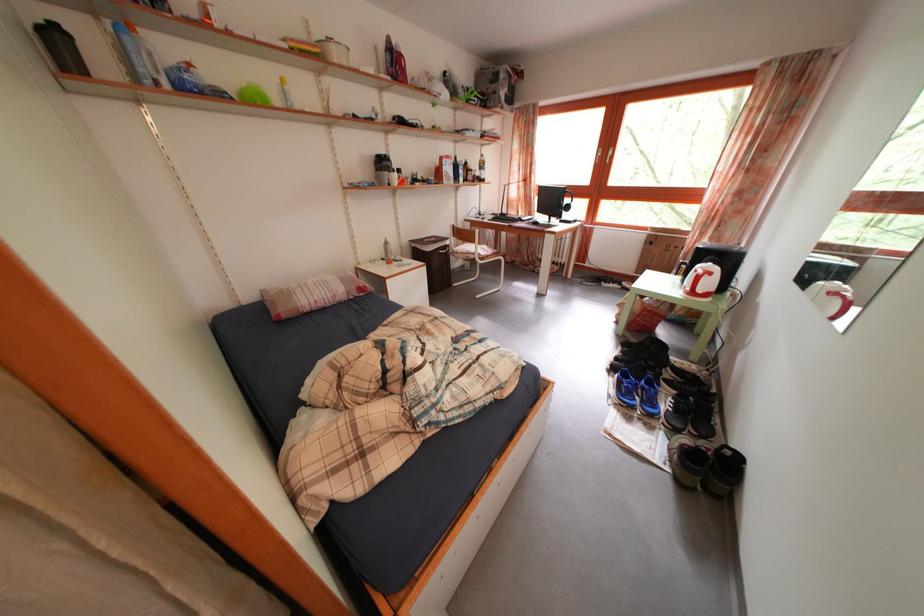
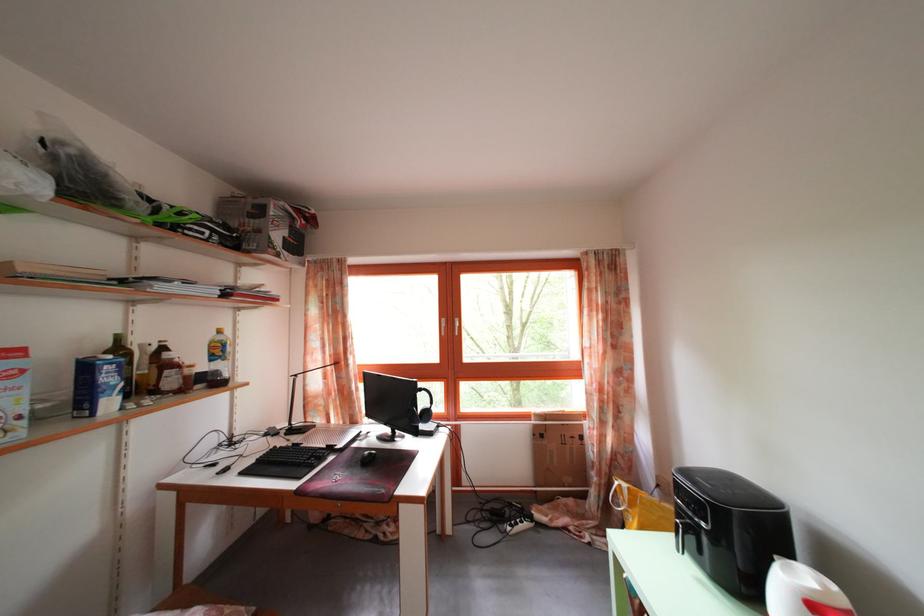
In the second image, find the point that corresponds to (x=464, y=164) in the first image.

(126, 346)